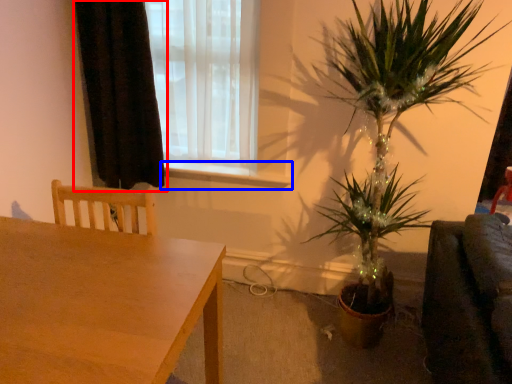
Question: Among these objects, which one is farthest to the camera, curtain (highlighted by a red box) or window sill (highlighted by a blue box)?

Choices:
 (A) curtain
 (B) window sill

Answer: (B)